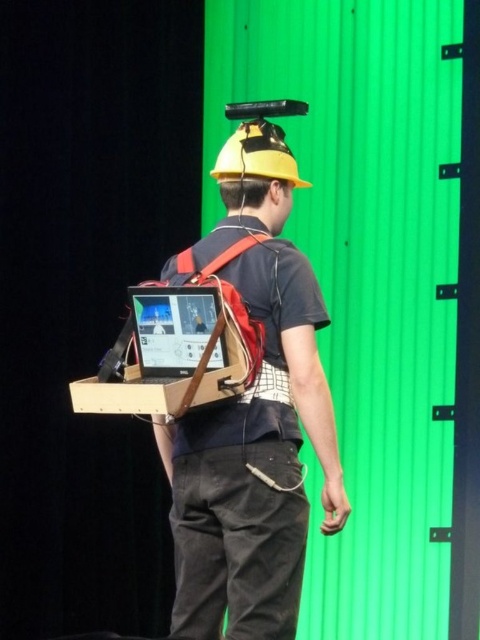
Question: Among these points, which one is nearest to the camera?

Choices:
 (A) (259, 177)
 (B) (204, 296)

Answer: (B)

Question: Is matte black laptop at back to the left of yellow matte hardhat at center from the viewer's perspective?

Choices:
 (A) no
 (B) yes

Answer: (B)

Question: Which of the following is the farthest from the observer?

Choices:
 (A) (203, 308)
 (B) (230, 163)

Answer: (B)

Question: In this image, where is matte black laptop at back located relative to yellow matte hardhat at center?

Choices:
 (A) below
 (B) above

Answer: (A)

Question: Can you confirm if matte black laptop at back is wider than yellow matte hardhat at center?

Choices:
 (A) no
 (B) yes

Answer: (A)